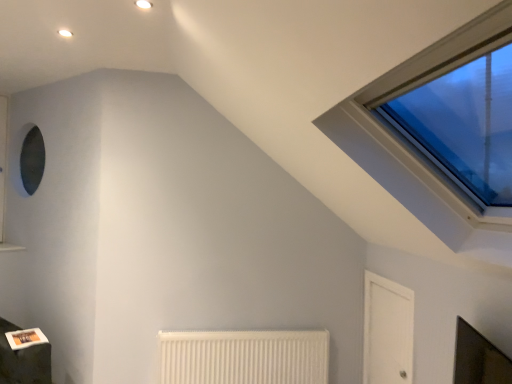
Question: Is white ribbed radiator at lower center wider or thinner than white glossy door at lower right?

Choices:
 (A) thin
 (B) wide

Answer: (B)

Question: Is point (190, 344) closer or farther from the camera than point (403, 324)?

Choices:
 (A) farther
 (B) closer

Answer: (A)

Question: Considering the relative positions of white ribbed radiator at lower center and white glossy door at lower right in the image provided, is white ribbed radiator at lower center to the left or to the right of white glossy door at lower right?

Choices:
 (A) right
 (B) left

Answer: (B)

Question: Considering their positions, is white glossy door at lower right located in front of or behind white ribbed radiator at lower center?

Choices:
 (A) front
 (B) behind

Answer: (A)

Question: Does point (380, 329) appear closer or farther from the camera than point (223, 365)?

Choices:
 (A) farther
 (B) closer

Answer: (B)

Question: Which is correct: white glossy door at lower right is inside white ribbed radiator at lower center, or outside of it?

Choices:
 (A) inside
 (B) outside

Answer: (B)

Question: In terms of width, does white glossy door at lower right look wider or thinner when compared to white ribbed radiator at lower center?

Choices:
 (A) thin
 (B) wide

Answer: (A)